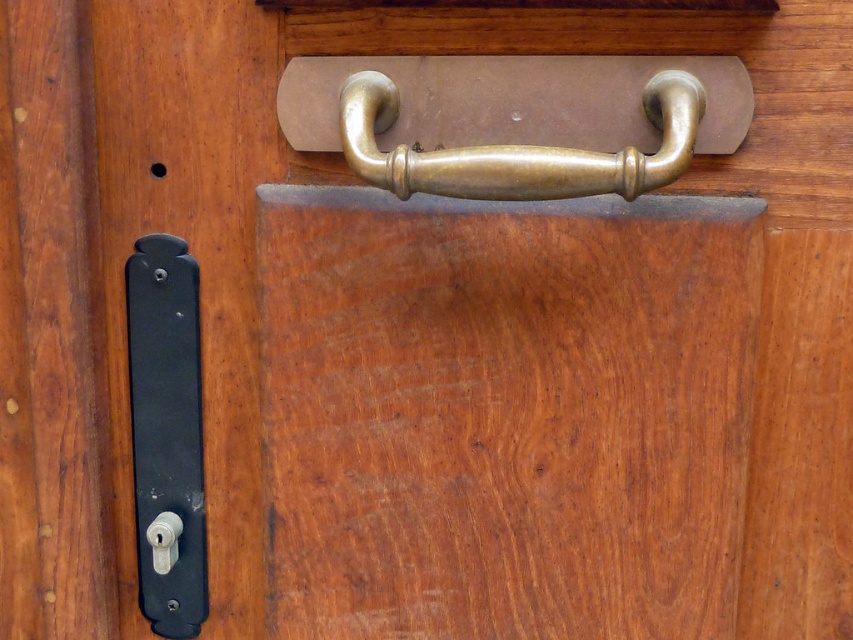
Can you confirm if black matte door handle at lower left is positioned below brass/bronze handle at center?

Indeed, black matte door handle at lower left is positioned under brass/bronze handle at center.

Is black matte door handle at lower left above brass/bronze handle at center?

No, black matte door handle at lower left is not above brass/bronze handle at center.

Between point (148, 499) and point (671, 176), which one is positioned in front?

Point (671, 176) is in front.

At what (x,y) coordinates should I click in order to perform the action: click on black matte door handle at lower left. Please return your answer as a coordinate pair (x, y). Image resolution: width=853 pixels, height=640 pixels. Looking at the image, I should click on (166, 433).

Who is shorter, brass/bronze handle at center or white plastic knob at lower left?

With less height is white plastic knob at lower left.

Consider the image. Does brass/bronze handle at center come behind white plastic knob at lower left?

No, brass/bronze handle at center is in front of white plastic knob at lower left.

Between point (424, 182) and point (155, 557), which one is positioned behind?

The point (155, 557) is more distant.

At what (x,y) coordinates should I click in order to perform the action: click on brass/bronze handle at center. Please return your answer as a coordinate pair (x, y). The image size is (853, 640). Looking at the image, I should click on (518, 150).

Which is in front, point (138, 285) or point (152, 552)?

Point (138, 285)

Is black matte door handle at lower left below white plastic knob at lower left?

No, black matte door handle at lower left is not below white plastic knob at lower left.

Who is more forward, (172, 609) or (169, 525)?

Point (169, 525) is in front.

The image size is (853, 640). Identify the location of black matte door handle at lower left. (166, 433).